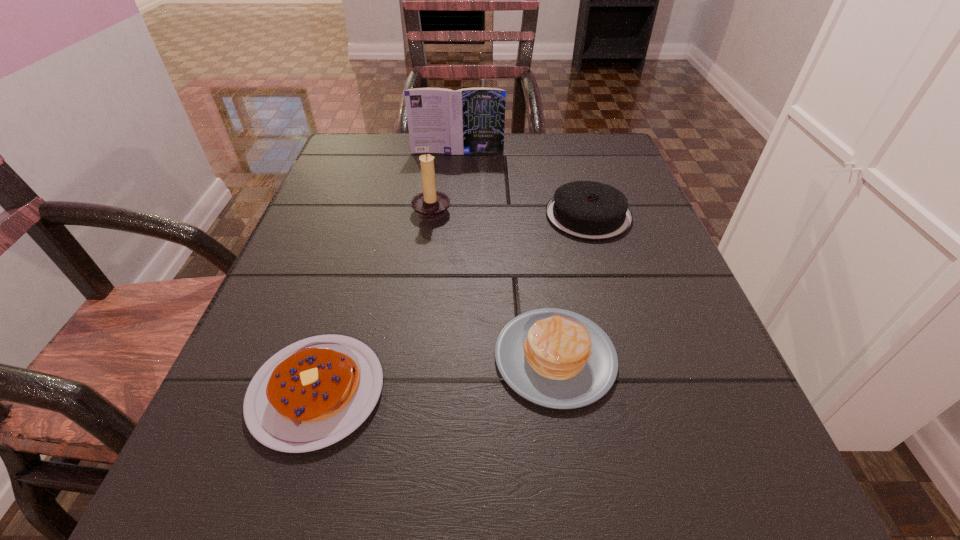
Find the location of `vacant point located between the candle holder and the shortest pancake`. vacant point located between the candle holder and the shortest pancake is located at coordinates (374, 300).

This screenshot has height=540, width=960. Identify the location of empty location between the candle holder and the shortest pancake. (374, 300).

The height and width of the screenshot is (540, 960). Identify the location of the fourth closest object to the farthest pancake. (313, 393).

Identify which object is the closest to the book. Please provide its 2D coordinates. Your answer should be formatted as a tuple, i.e. [(x, y)], where the tuple contains the x and y coordinates of a point satisfying the conditions above.

[(430, 205)]

Where is `pancake identified as the third closest to the farthest object`? Image resolution: width=960 pixels, height=540 pixels. pancake identified as the third closest to the farthest object is located at coordinates (313, 393).

At what (x,y) coordinates should I click in order to perform the action: click on pancake that is the second closest one to the shortest object. Please return your answer as a coordinate pair (x, y). Looking at the image, I should click on (586, 210).

Identify the location of free location that satisfies the following two spatial constraints: 1. on the back side of the farthest pancake; 2. on the wick of the candle holder. (587, 208).

You are a GUI agent. You are given a task and a screenshot of the screen. Output one action in this format:
    pyautogui.click(x=<x>, y=<y>)
    Task: Click on the free space in the image that satisfies the following two spatial constraints: 1. on the back side of the farthest pancake; 2. on the wick of the candle holder
    
    Given the screenshot: What is the action you would take?
    pyautogui.click(x=587, y=208)

What are the coordinates of `vacant space that satisfies the following two spatial constraints: 1. on the front cover of the book; 2. on the left side of the farthest pancake` in the screenshot? It's located at (453, 215).

Identify the location of vacant region that satisfies the following two spatial constraints: 1. on the front cover of the book; 2. on the wick of the candle holder. (453, 208).